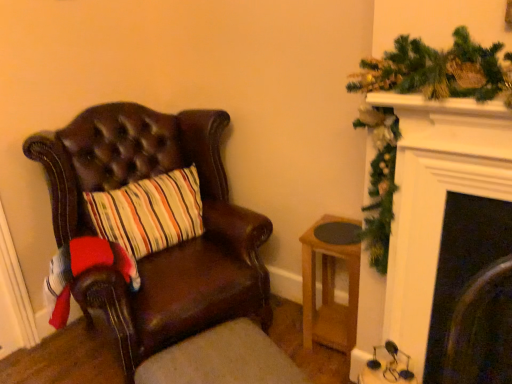
Question: Is brown leather footrest at lower left aimed at light brown wooden stool at lower right?

Choices:
 (A) yes
 (B) no

Answer: (B)

Question: Can you confirm if brown leather footrest at lower left is wider than light brown wooden stool at lower right?

Choices:
 (A) yes
 (B) no

Answer: (A)

Question: Does brown leather footrest at lower left have a greater height compared to light brown wooden stool at lower right?

Choices:
 (A) no
 (B) yes

Answer: (A)

Question: Can you confirm if brown leather footrest at lower left is bigger than light brown wooden stool at lower right?

Choices:
 (A) yes
 (B) no

Answer: (A)

Question: Would you say brown leather footrest at lower left is a long distance from light brown wooden stool at lower right?

Choices:
 (A) yes
 (B) no

Answer: (B)

Question: Relative to brown leather footrest at lower left, is light brown wooden stool at lower right in front or behind?

Choices:
 (A) behind
 (B) front

Answer: (A)

Question: Is point (309, 306) closer or farther from the camera than point (155, 362)?

Choices:
 (A) farther
 (B) closer

Answer: (A)

Question: Considering the positions of light brown wooden stool at lower right and brown leather footrest at lower left in the image, is light brown wooden stool at lower right taller or shorter than brown leather footrest at lower left?

Choices:
 (A) short
 (B) tall

Answer: (B)

Question: Would you say light brown wooden stool at lower right is to the left or to the right of brown leather footrest at lower left in the picture?

Choices:
 (A) right
 (B) left

Answer: (A)

Question: Considering the relative positions of leather chair at left and brown leather footrest at lower left in the image provided, is leather chair at left to the left or to the right of brown leather footrest at lower left?

Choices:
 (A) left
 (B) right

Answer: (A)

Question: From a real-world perspective, is leather chair at left above or below brown leather footrest at lower left?

Choices:
 (A) below
 (B) above

Answer: (B)

Question: In the image, is leather chair at left positioned in front of or behind brown leather footrest at lower left?

Choices:
 (A) behind
 (B) front

Answer: (A)

Question: Is leather chair at left inside the boundaries of brown leather footrest at lower left, or outside?

Choices:
 (A) inside
 (B) outside

Answer: (B)

Question: From the image's perspective, is brown leather footrest at lower left above or below leather chair at left?

Choices:
 (A) below
 (B) above

Answer: (A)

Question: Looking at their shapes, would you say brown leather footrest at lower left is wider or thinner than leather chair at left?

Choices:
 (A) wide
 (B) thin

Answer: (B)